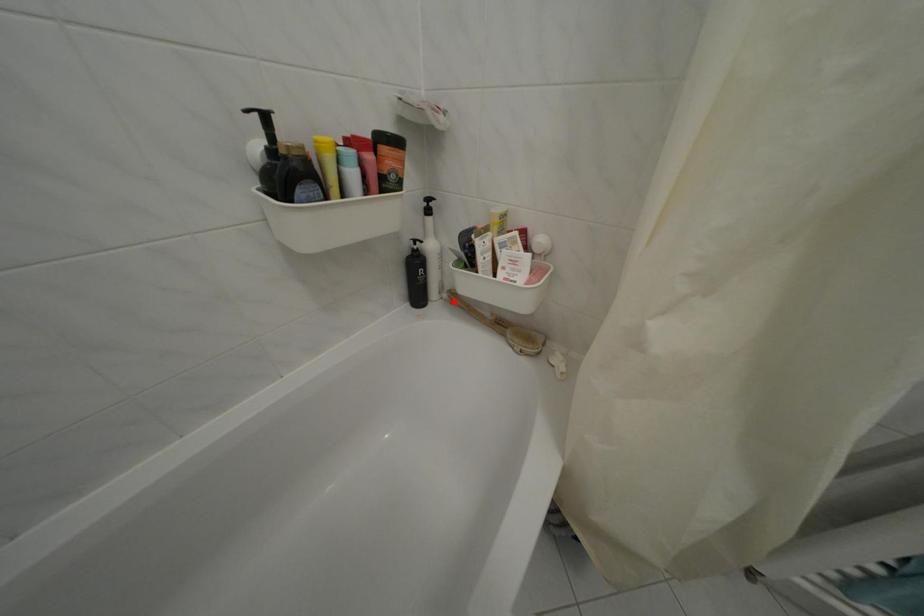
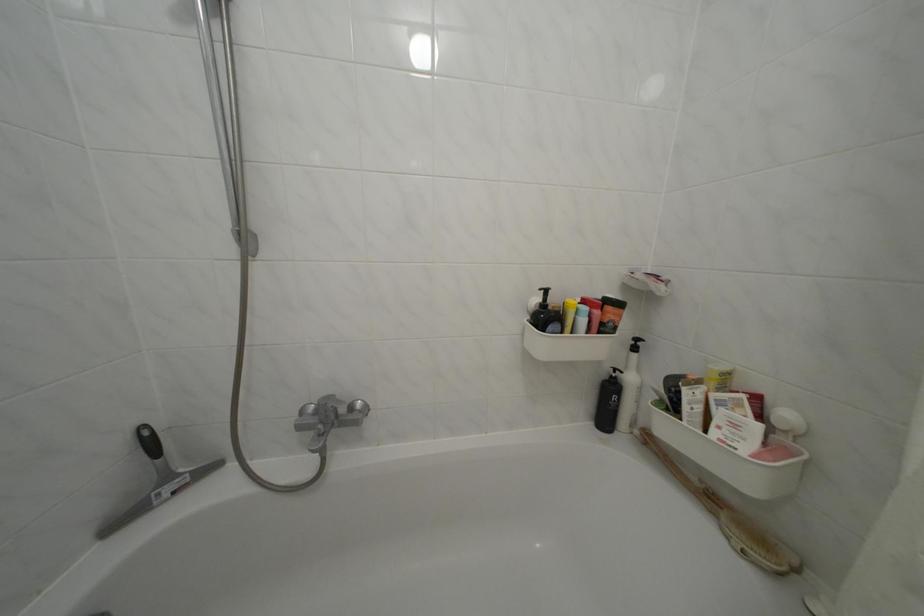
Question: I am providing you with two images of the same scene from different viewpoints. A red point is shown in image1. For the corresponding object point in image2, is it positioned nearer or farther from the camera?

Choices:
 (A) Nearer
 (B) Farther

Answer: (B)